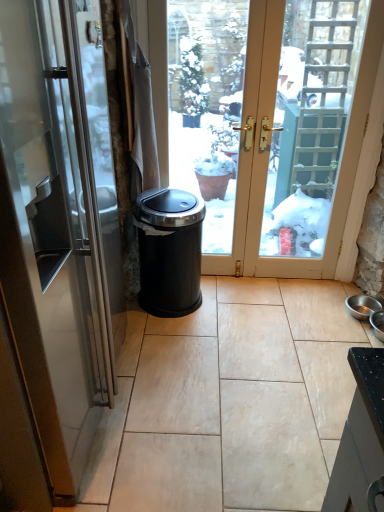
I want to click on vacant space in front of black plastic trash can at center, so click(x=182, y=341).